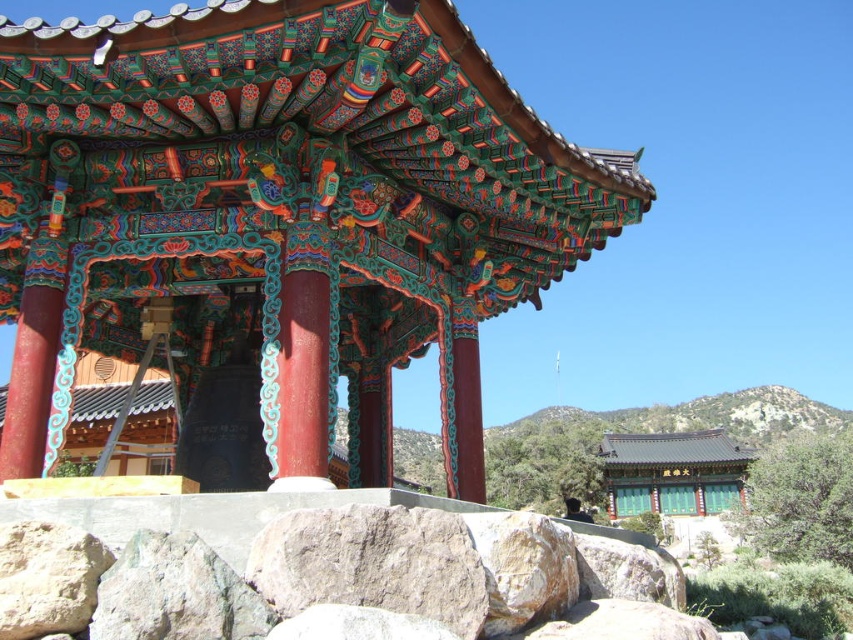
Is polychrome wood gazebo at center positioned behind gray rough rock at lower center?

Yes, it is behind gray rough rock at lower center.

Who is higher up, polychrome wood gazebo at center or gray rough rock at lower center?

Positioned higher is polychrome wood gazebo at center.

Between point (605, 208) and point (457, 515), which one is positioned behind?

Point (605, 208)

The height and width of the screenshot is (640, 853). In order to click on polychrome wood gazebo at center in this screenshot , I will do `click(280, 216)`.